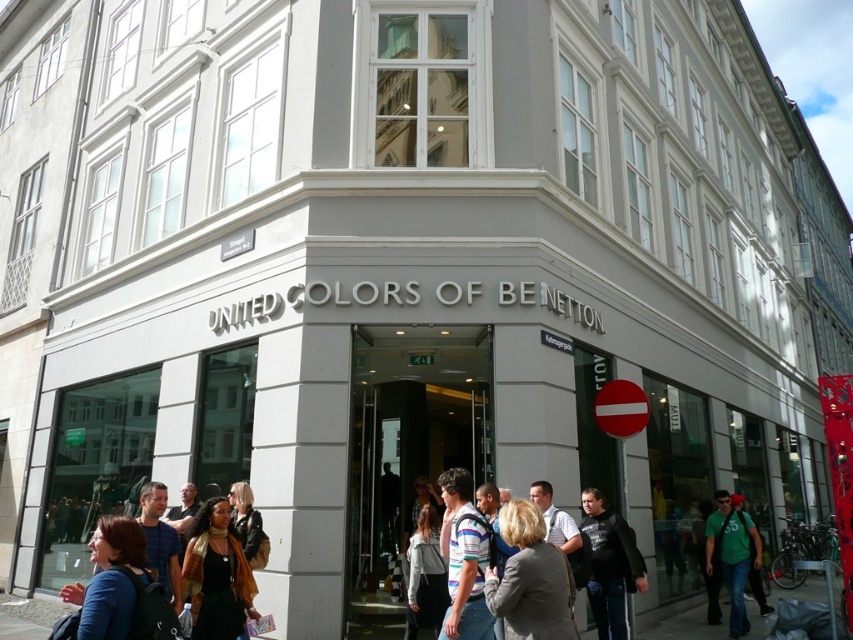
Question: Which object is positioned closest to the gray fabric jacket at center?

Choices:
 (A) concrete pavement at lower center
 (B) black leather jacket at lower center
 (C) green matte shirt at lower right

Answer: (B)

Question: Which of these objects is positioned closest to the black leather jacket at lower center?

Choices:
 (A) dark gray hoodie at lower center
 (B) matte blue shirt at lower left

Answer: (B)

Question: Which point is closer to the camera?

Choices:
 (A) (543, 525)
 (B) (445, 630)

Answer: (A)

Question: Is gray fabric jacket at center to the right of striped cotton shirt at center from the viewer's perspective?

Choices:
 (A) yes
 (B) no

Answer: (A)

Question: Does gray fabric jacket at center lie in front of blue striped shirt at center?

Choices:
 (A) no
 (B) yes

Answer: (B)

Question: Does matte blue shirt at lower left have a lesser width compared to blue striped shirt at center?

Choices:
 (A) no
 (B) yes

Answer: (B)